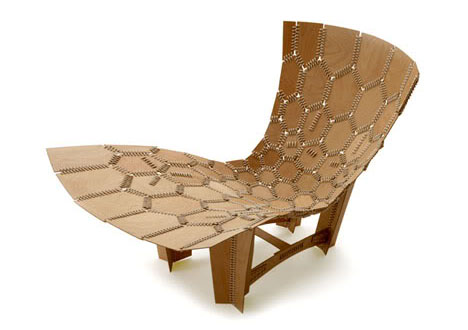
The height and width of the screenshot is (330, 468). Find the location of `white floor`. white floor is located at coordinates (352, 276).